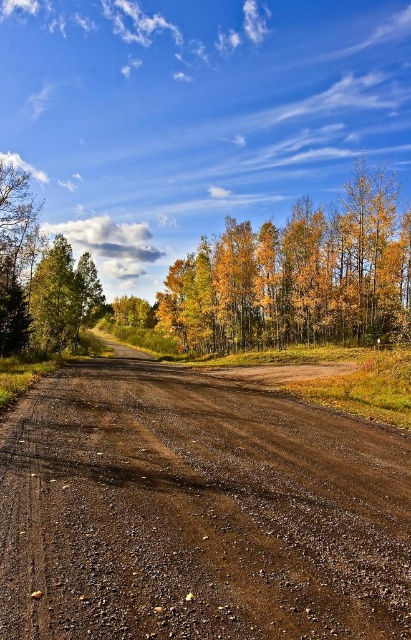
Does brown gravel road at center have a smaller size compared to golden leaves forest at center?

Yes, brown gravel road at center is smaller than golden leaves forest at center.

Is brown gravel road at center wider than golden leaves forest at center?

No, brown gravel road at center is not wider than golden leaves forest at center.

Is point (92, 456) more distant than point (397, 259)?

No, it is not.

Locate an element on the screen. brown gravel road at center is located at coordinates (196, 513).